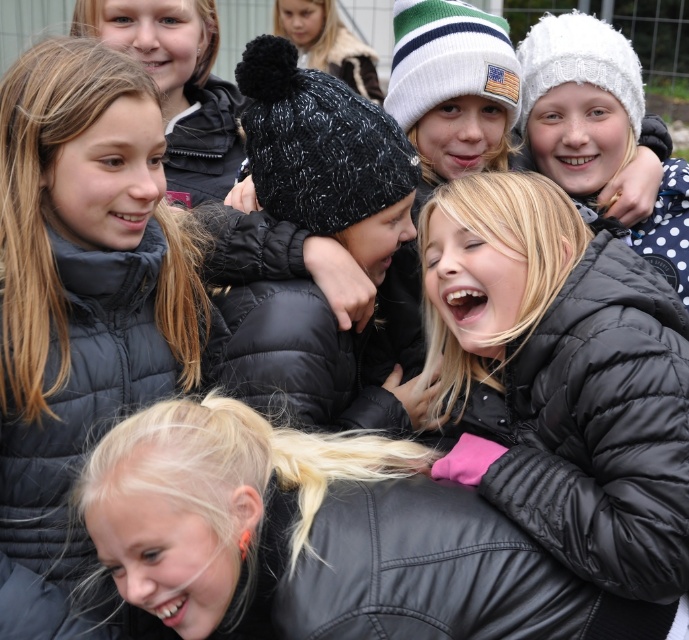
Is black quilted jacket at lower right bigger than black fuzzy beanie at upper center?

Actually, black quilted jacket at lower right might be smaller than black fuzzy beanie at upper center.

This screenshot has width=689, height=640. What do you see at coordinates (597, 428) in the screenshot? I see `black quilted jacket at lower right` at bounding box center [597, 428].

Identify the location of black quilted jacket at lower right. This screenshot has width=689, height=640. (597, 428).

Does black quilted jacket at lower right have a smaller size compared to black puffer jacket at center?

No, black quilted jacket at lower right is not smaller than black puffer jacket at center.

Where is `black quilted jacket at lower right`? The image size is (689, 640). black quilted jacket at lower right is located at coordinates (597, 428).

You are a GUI agent. You are given a task and a screenshot of the screen. Output one action in this format:
    pyautogui.click(x=<x>, y=<y>)
    Task: Click on the black quilted jacket at lower right
    The width and height of the screenshot is (689, 640).
    Given the screenshot: What is the action you would take?
    click(597, 428)

This screenshot has height=640, width=689. Identify the location of black quilted jacket at lower right. pyautogui.click(x=597, y=428).

Does black puffer jacket at center have a larger size compared to black fuzzy beanie at upper center?

Actually, black puffer jacket at center might be smaller than black fuzzy beanie at upper center.

Which is more to the right, black puffer jacket at center or black fuzzy beanie at upper center?

Positioned to the right is black fuzzy beanie at upper center.

Is point (329, 381) closer to camera compared to point (294, 33)?

That is True.

Image resolution: width=689 pixels, height=640 pixels. In order to click on black puffer jacket at center in this screenshot , I will do `click(291, 342)`.